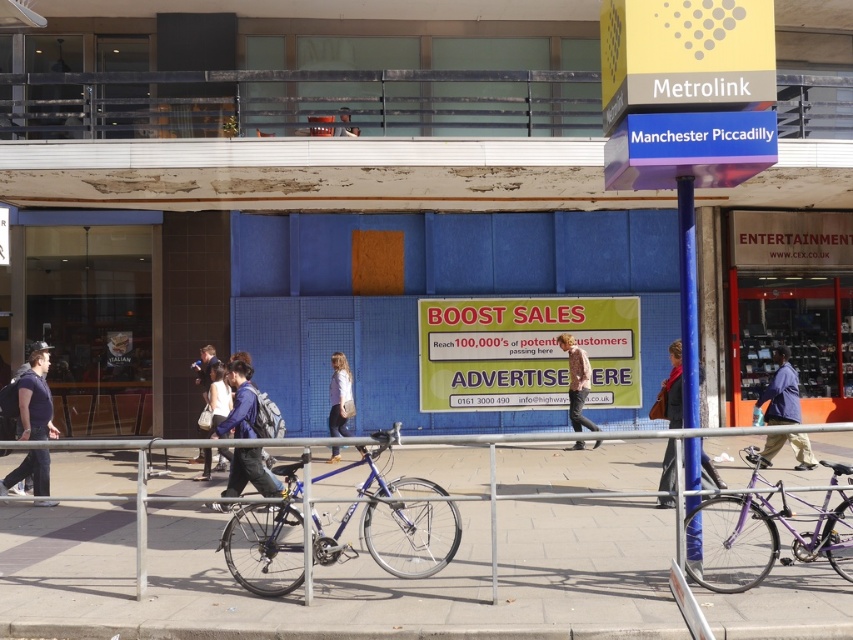
You are a pedestrian standing in front of the Metrolink station sign for Manchester Piccadilly. You see a blue denim jacket at center and a light brown leather jacket at center. Which jacket is closer to the ground?

The blue denim jacket at center is positioned under the light brown leather jacket at center, so it is closer to the ground.

You are a fashion blogger observing two jackets displayed at a store window. You see a matte blue jacket at center and a denim jacket at center. Which jacket appears shorter in height?

The matte blue jacket at center has a lesser height compared to the denim jacket at center, so the matte blue jacket at center appears shorter.

You are a delivery person needing to place a 5 feet long package between the blue denim jacket at center and the light brown leather jacket at center. Can you fit it there?

The distance between the blue denim jacket at center and the light brown leather jacket at center is 9.49 feet. Since the package is 5 feet long, it can fit as there is enough space between them.